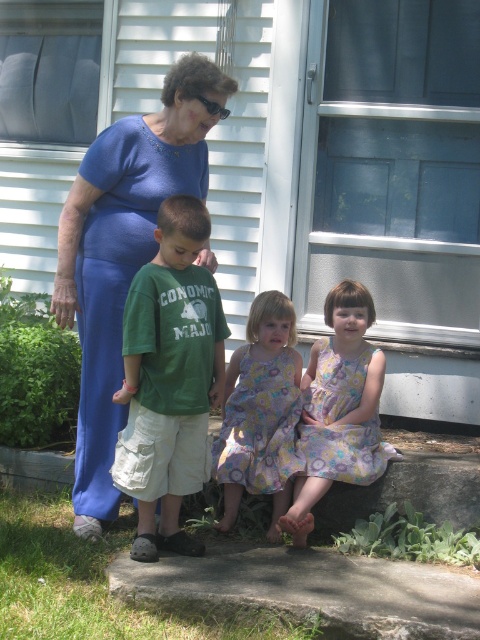
You are standing at the base of the concrete step leading to the house. You see two points marked on the step. The first point is at coordinates point (162,124) and the second point is at point (223,358). Which point is closer to you?

Point (162,124) is closer to the camera than point (223,358), so the first point is closer to you.

You are standing in front of the house and want to place a small potted plant between the two points labeled point (x=321, y=461) and point (x=248, y=376) on the concrete step. Which point should the plant be closer to in order to be nearer to the house entrance?

The plant should be closer to point (x=248, y=376) because it is farther from the viewer than point (x=321, y=461), meaning it is nearer to the house entrance.